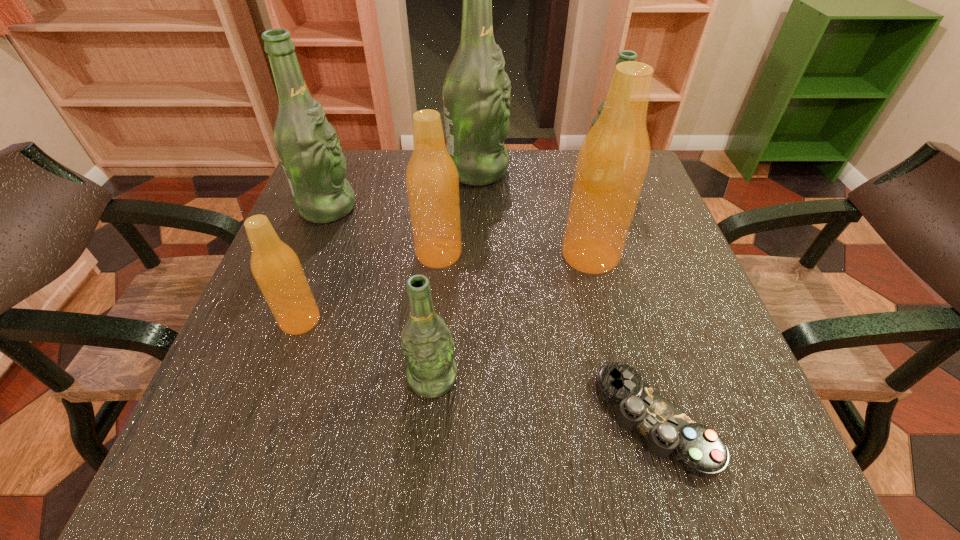
Locate an element on the screen. the biggest green beer bottle is located at coordinates (476, 92).

Where is `the tallest object`? the tallest object is located at coordinates (476, 92).

You are a GUI agent. You are given a task and a screenshot of the screen. Output one action in this format:
    pyautogui.click(x=<x>, y=<y>)
    Task: Click on the leftmost green beer bottle
    This screenshot has width=960, height=540.
    Given the screenshot: What is the action you would take?
    pyautogui.click(x=308, y=147)

I want to click on the rightmost tan beer bottle, so tap(613, 159).

At what (x,y) coordinates should I click in order to perform the action: click on the rightmost green beer bottle. Please return your answer as a coordinate pair (x, y). The height and width of the screenshot is (540, 960). Looking at the image, I should click on (626, 55).

Where is `the second tan beer bottle from left to right`? the second tan beer bottle from left to right is located at coordinates (432, 182).

This screenshot has width=960, height=540. I want to click on the leftmost tan beer bottle, so click(x=275, y=266).

I want to click on the second nearest beer bottle, so click(x=275, y=266).

The image size is (960, 540). I want to click on the smallest green beer bottle, so (x=427, y=345).

Where is `the nearest beer bottle`? the nearest beer bottle is located at coordinates (427, 345).